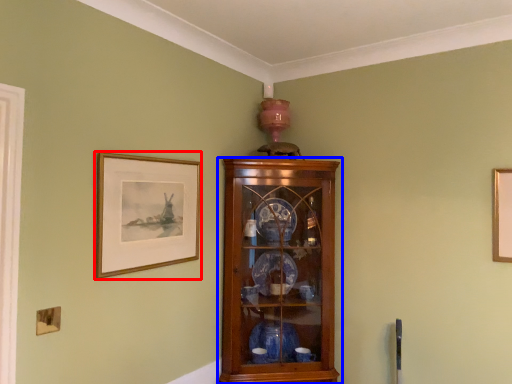
Question: Among these objects, which one is nearest to the camera, picture frame (highlighted by a red box) or cupboard (highlighted by a blue box)?

Choices:
 (A) picture frame
 (B) cupboard

Answer: (A)